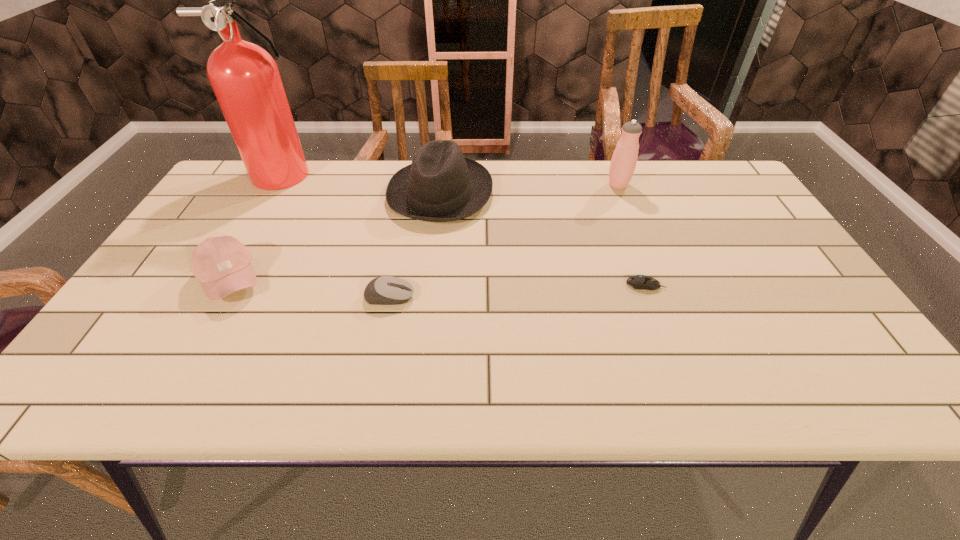
Where is `vacant space that's between the baseball cap and the shorter computer mouse`? vacant space that's between the baseball cap and the shorter computer mouse is located at coordinates (438, 282).

Locate an element on the screen. The height and width of the screenshot is (540, 960). free space that is in between the taller computer mouse and the shortest object is located at coordinates (517, 291).

The height and width of the screenshot is (540, 960). Identify the location of vacant space in between the second shortest object and the thermos bottle. (504, 241).

The width and height of the screenshot is (960, 540). In order to click on vacant area that lies between the shorter computer mouse and the baseball cap in this screenshot , I will do `click(438, 282)`.

The height and width of the screenshot is (540, 960). Find the location of `empty space between the fire extinguisher and the third shortest object`. empty space between the fire extinguisher and the third shortest object is located at coordinates (260, 227).

Image resolution: width=960 pixels, height=540 pixels. Identify the location of the fifth closest object to the second shortest object. (623, 163).

The width and height of the screenshot is (960, 540). I want to click on object that can be found as the closest to the fifth shortest object, so click(x=441, y=185).

This screenshot has height=540, width=960. What are the coordinates of `vacant region that satisfies the following two spatial constraints: 1. on the front side of the fire extinguisher; 2. on the right side of the third tallest object` in the screenshot? It's located at (281, 193).

Where is `free space that satisfies the following two spatial constraints: 1. on the front side of the thermos bottle; 2. on the front-facing side of the baseball cap`? free space that satisfies the following two spatial constraints: 1. on the front side of the thermos bottle; 2. on the front-facing side of the baseball cap is located at coordinates (655, 279).

Locate an element on the screen. vacant point that satisfies the following two spatial constraints: 1. on the front side of the tallest object; 2. on the front-facing side of the fourth tallest object is located at coordinates (233, 279).